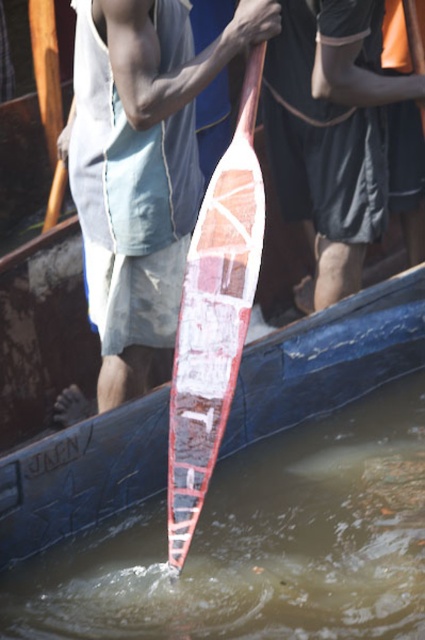
You are a safety inspector checking the safety of the boat activity. The safety guidelines state that the distance between the translucent water at paddle center and the matte white paddle at center must be at least 2 meters to prevent accidental immersion. Is the current setup compliant with the guidelines?

The distance between the translucent water at paddle center and the matte white paddle at center is 1.86 meters, which is less than the required 2 meters. Therefore, the current setup does not comply with the safety guidelines.

You are a photographer trying to capture the wooden surfboard at center and the wooden paddle at center in a single shot. Which object should you focus on first to ensure both are in frame?

The wooden surfboard at center is in front of the wooden paddle at center, so you should focus on the wooden surfboard at center first to ensure both are in frame.

You are planning to carry both the wooden surfboard at center and the wooden paddle at center to the storage room. Which one will you pick up first if you want to carry the larger item first?

The wooden surfboard at center is larger than the wooden paddle at center, so you should pick up the wooden surfboard at center first.